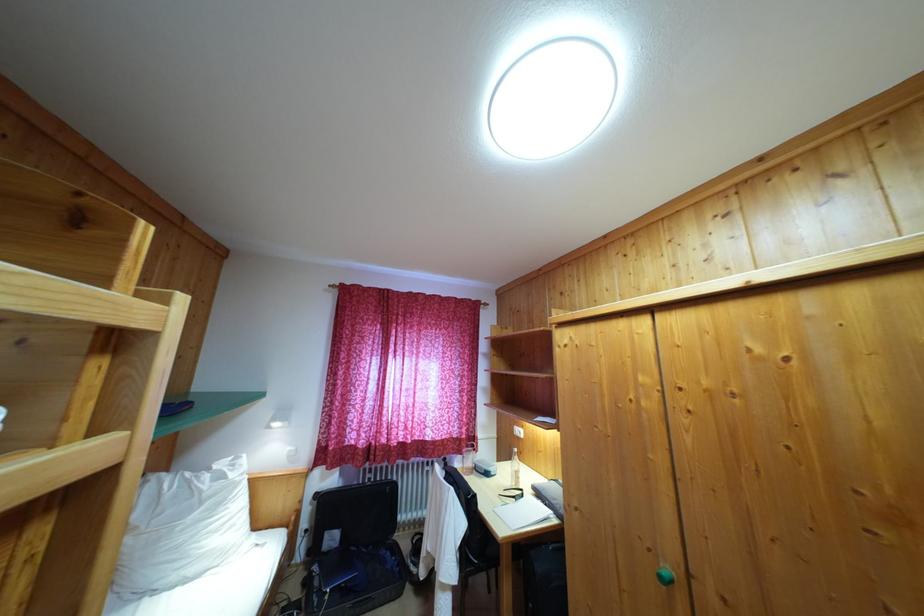
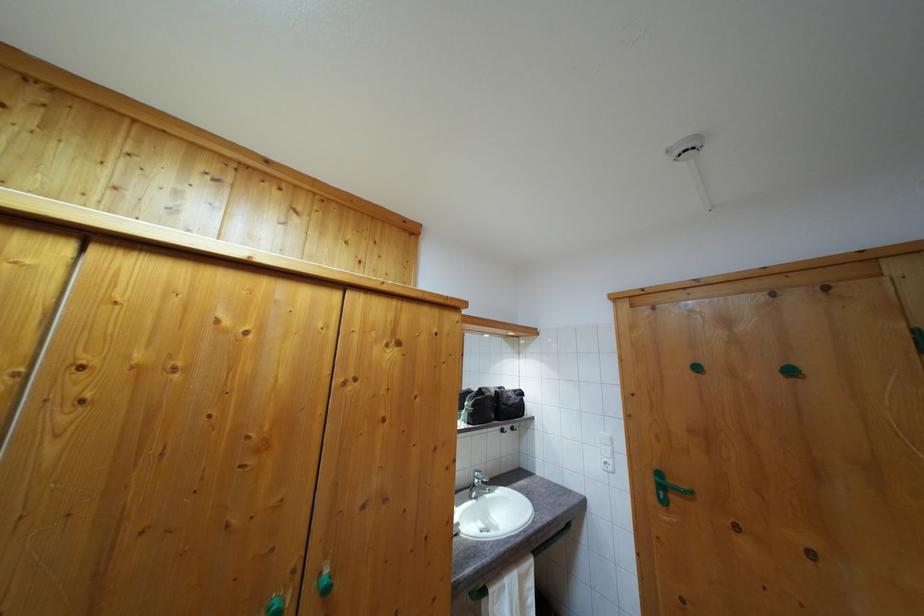
Question: The camera is either moving clockwise (left) or counter-clockwise (right) around the object. The first image is from the beginning of the video and the second image is from the end. Is the camera moving left or right when shooting the video?

Choices:
 (A) Left
 (B) Right

Answer: (A)